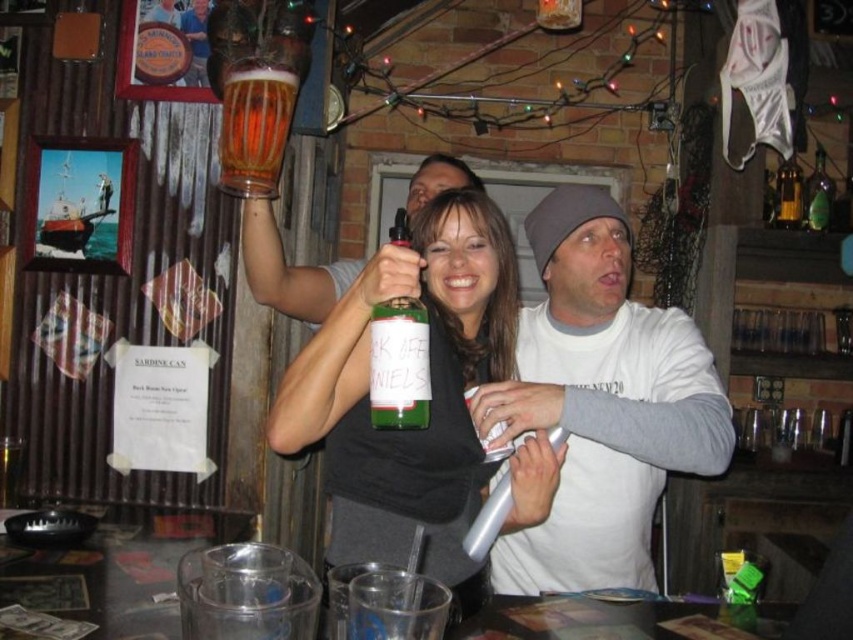
Question: Considering the relative positions of green matte bottle at center and green glass bottle at center in the image provided, where is green matte bottle at center located with respect to green glass bottle at center?

Choices:
 (A) below
 (B) above

Answer: (A)

Question: Does green matte bottle at center lie in front of translucent glass bottle at upper right?

Choices:
 (A) yes
 (B) no

Answer: (A)

Question: Which object is closer to the camera taking this photo?

Choices:
 (A) translucent glass bottle at upper right
 (B) white cotton shirt at center
 (C) green glass bottle at upper right

Answer: (B)

Question: Which of the following is the closest to the observer?

Choices:
 (A) green glass bottle at center
 (B) translucent glass mug at upper center
 (C) white cotton shirt at center

Answer: (A)

Question: Is translucent glass mug at upper center in front of green glass bottle at upper right?

Choices:
 (A) yes
 (B) no

Answer: (A)

Question: Based on their relative distances, which object is nearer to the green glass bottle at upper right?

Choices:
 (A) green glass bottle at center
 (B) green matte bottle at center
 (C) white cotton shirt at center
 (D) translucent glass bottle at upper right

Answer: (D)